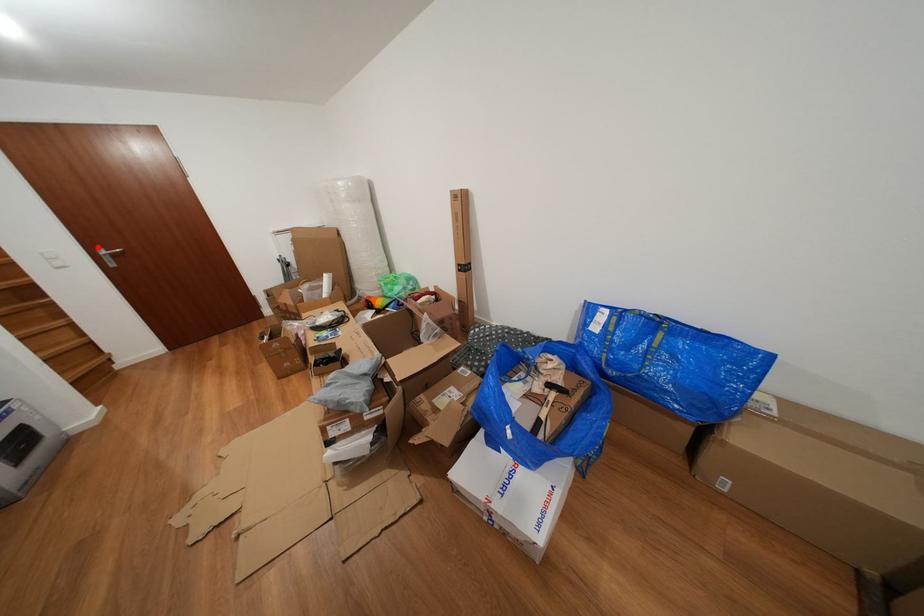
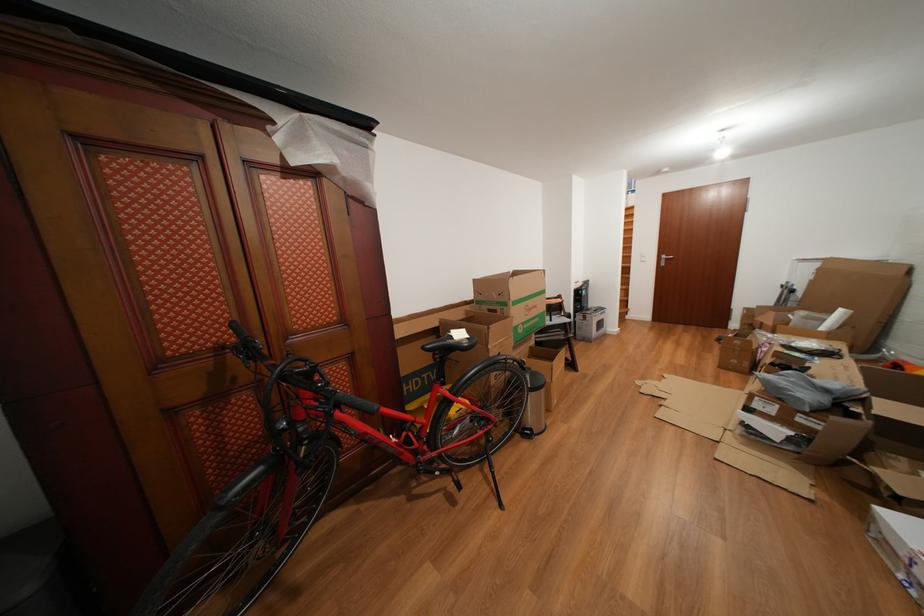
Where in the second image is the point corresponding to the highlighted location from the first image?

(670, 256)